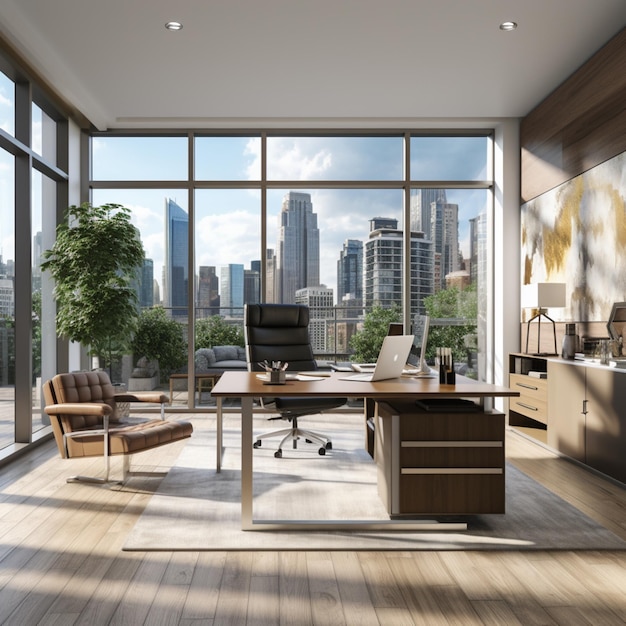
Where is `buildings through window`? buildings through window is located at coordinates (409, 264), (436, 250), (308, 250), (317, 304), (239, 282), (183, 257).